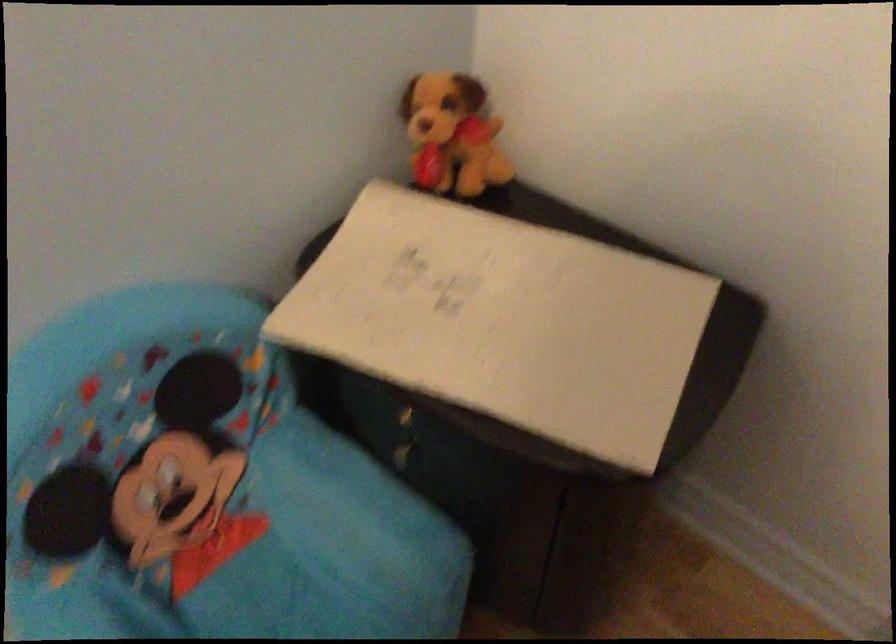
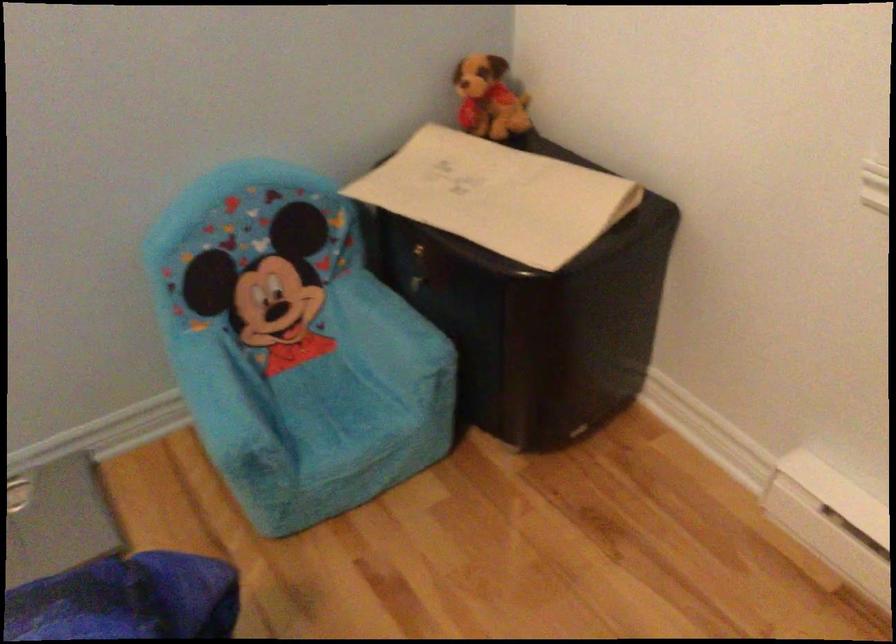
Find the pixel in the second image that matches point (507, 310) in the first image.

(497, 196)